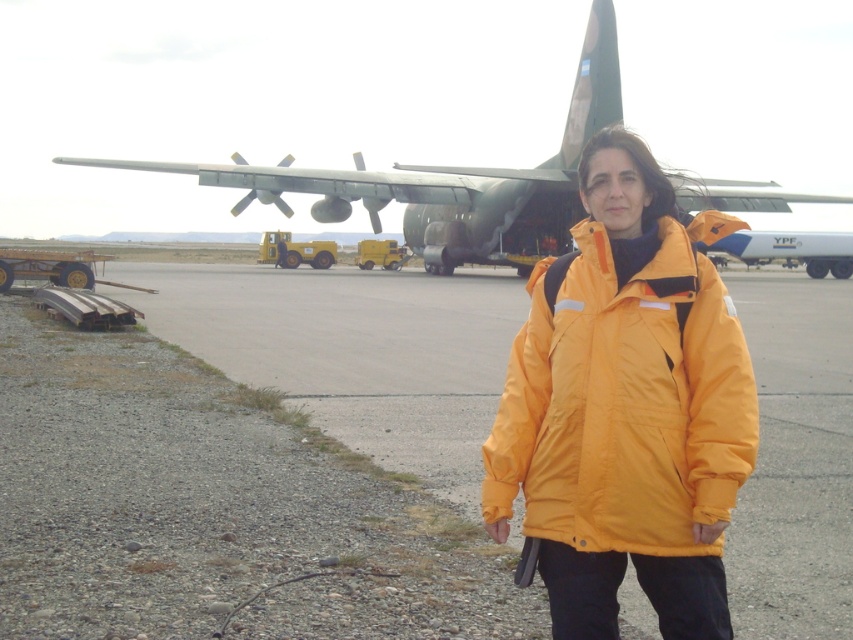
Describe the element at coordinates (625, 397) in the screenshot. The image size is (853, 640). I see `yellow matte jacket at center` at that location.

Does yellow matte jacket at center come in front of green matte airplane at upper center?

Yes, yellow matte jacket at center is closer to the viewer.

Where is `yellow matte jacket at center`? The height and width of the screenshot is (640, 853). yellow matte jacket at center is located at coordinates (625, 397).

Who is higher up, smooth asphalt tarmac at center or yellow matte jacket at center?

smooth asphalt tarmac at center is above.

Between smooth asphalt tarmac at center and yellow matte jacket at center, which one appears on the right side from the viewer's perspective?

smooth asphalt tarmac at center

What do you see at coordinates (254, 456) in the screenshot?
I see `smooth asphalt tarmac at center` at bounding box center [254, 456].

The width and height of the screenshot is (853, 640). I want to click on smooth asphalt tarmac at center, so click(254, 456).

Between smooth asphalt tarmac at center and green matte airplane at upper center, which one appears on the right side from the viewer's perspective?

green matte airplane at upper center

The height and width of the screenshot is (640, 853). What are the coordinates of `smooth asphalt tarmac at center` in the screenshot? It's located at (254, 456).

Locate an element on the screen. smooth asphalt tarmac at center is located at coordinates (254, 456).